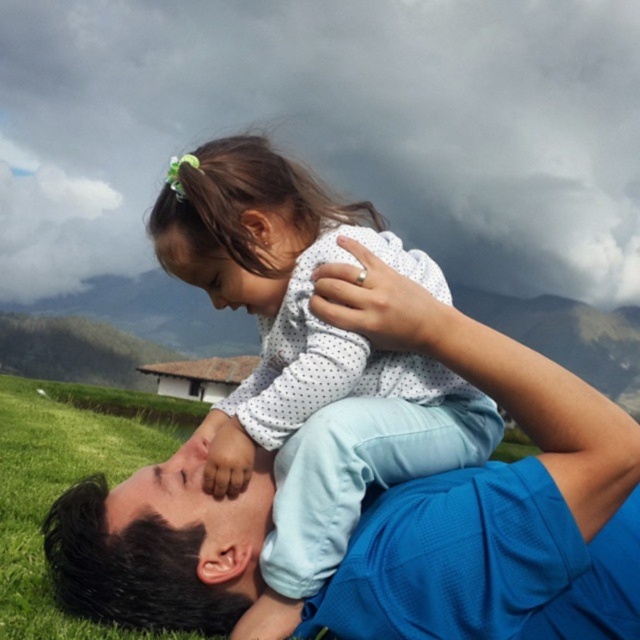
You are a photographer trying to capture the scene between the white dotted shirt at center and the green grass at lower left. Which object is narrower in width?

The white dotted shirt at center is thinner than the green grass at lower left, so the white dotted shirt at center is narrower in width.